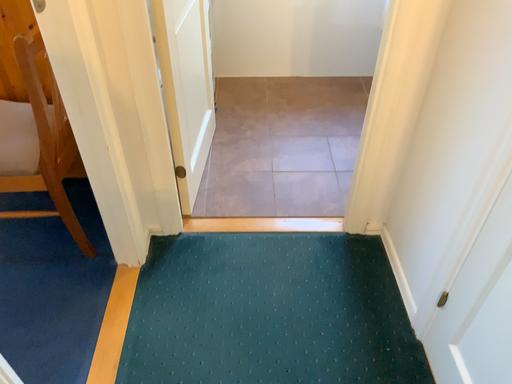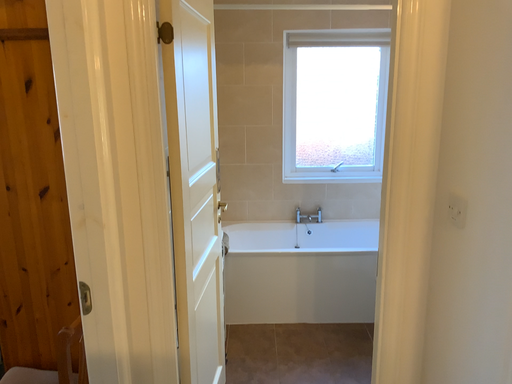
Question: Which way did the camera rotate in the video?

Choices:
 (A) rotated downward
 (B) rotated upward

Answer: (B)